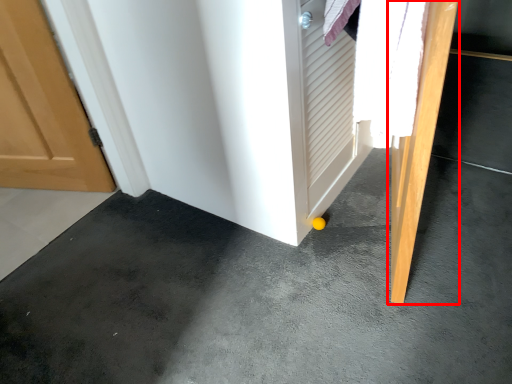
Question: In this image, where is door (annotated by the red box) located relative to concrete?

Choices:
 (A) left
 (B) right

Answer: (B)